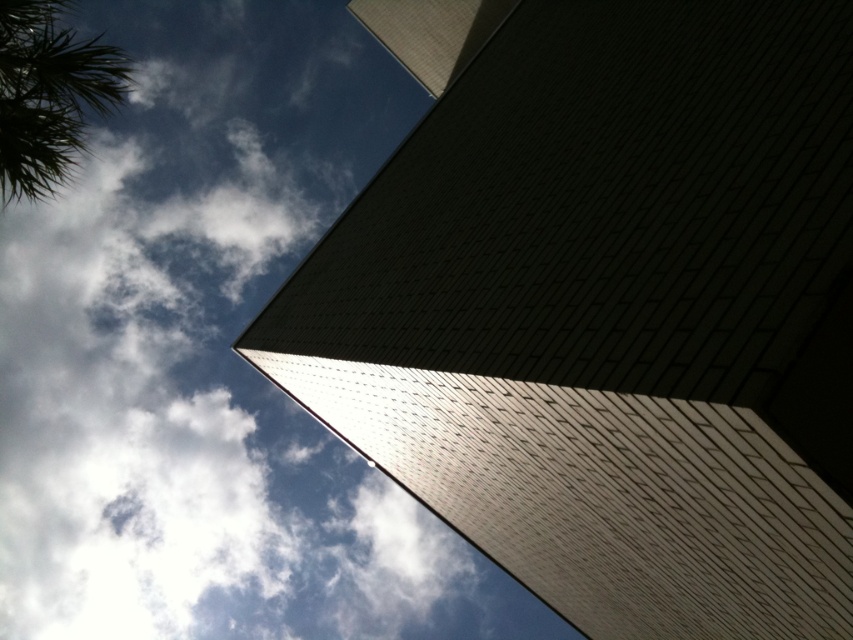
Can you confirm if white fluffy cloud at upper left is taller than green leafy palm tree at upper left?

Yes, white fluffy cloud at upper left is taller than green leafy palm tree at upper left.

Does white fluffy cloud at upper left have a greater width compared to green leafy palm tree at upper left?

Indeed, white fluffy cloud at upper left has a greater width compared to green leafy palm tree at upper left.

Does point (270, 147) lie in front of point (105, 88)?

That is False.

This screenshot has width=853, height=640. Identify the location of white fluffy cloud at upper left. (201, 353).